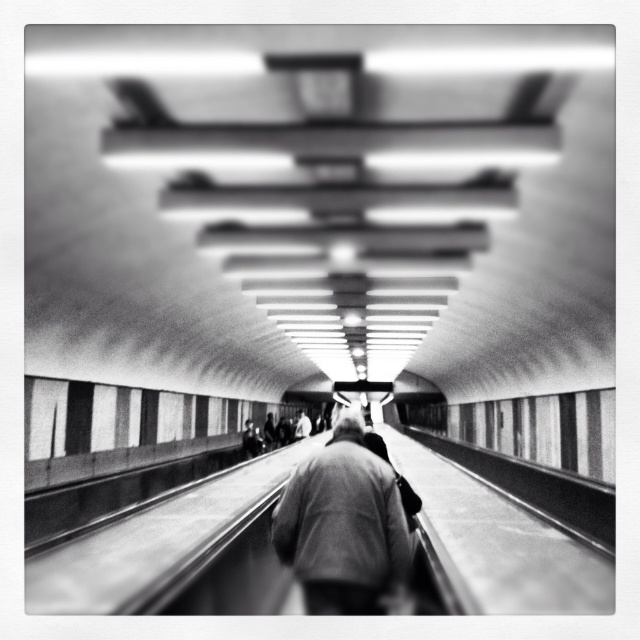
You are carrying a large backpack and need to walk through the corridor. You notice a dark gray wool coat at center and a light gray fabric jacket at center hanging on a rack nearby. Which garment should you choose to avoid getting caught on the corridor walls while walking?

You should choose the light gray fabric jacket at center because it is narrower than the dark gray wool coat at center, making it less likely to get caught on the corridor walls while walking.

Consider the image. You are standing in a subway corridor and see a dark gray wool coat at center and a light gray fabric jacket at center. Which one is taller?

The dark gray wool coat at center is much taller than the light gray fabric jacket at center.

You are standing in the subway corridor and see two coats hanging on a rack between the dark gray wool coat at center and the light gray fabric jacket at center. Which coat is to the right of the other?

The dark gray wool coat at center is positioned on the right side of the light gray fabric jacket at center.